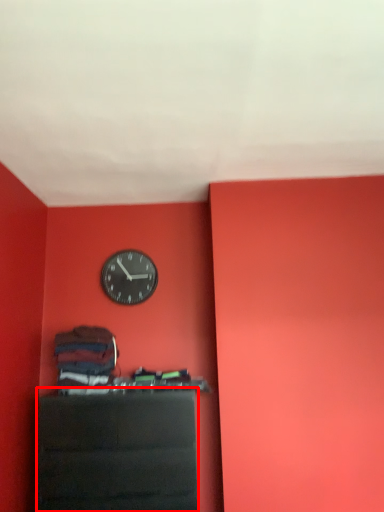
Question: From the image's perspective, what is the correct spatial positioning of furniture (annotated by the red box) in reference to wall clock?

Choices:
 (A) above
 (B) below

Answer: (B)